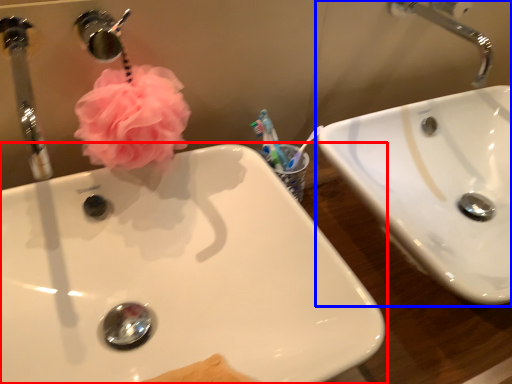
Question: Among these objects, which one is farthest to the camera, sink (highlighted by a red box) or sink (highlighted by a blue box)?

Choices:
 (A) sink
 (B) sink

Answer: (B)